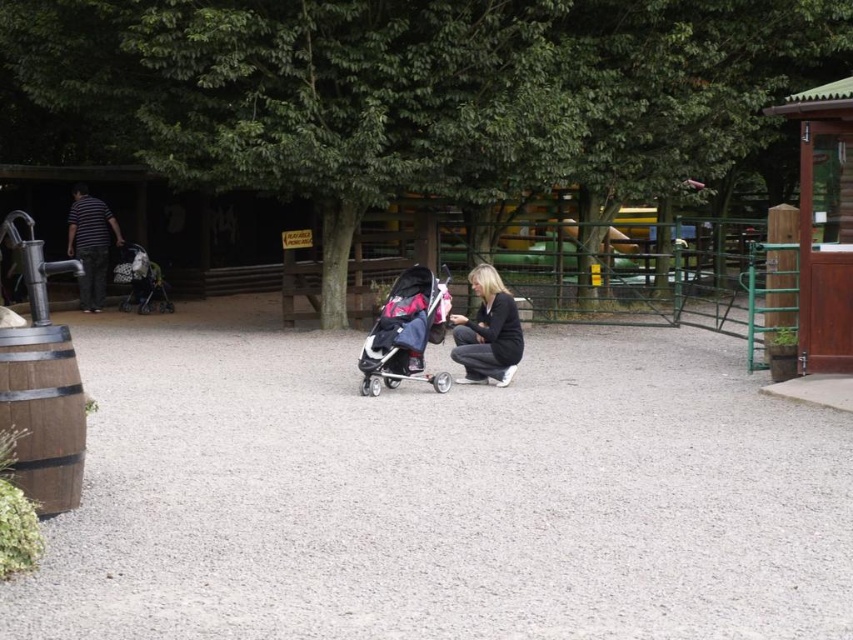
Question: Is gray gravel at center behind pink fabric stroller at center?

Choices:
 (A) no
 (B) yes

Answer: (A)

Question: Can you confirm if pink fabric stroller at center is thinner than dark gray fabric jacket at center?

Choices:
 (A) no
 (B) yes

Answer: (A)

Question: Can you confirm if pink fabric stroller at center is positioned to the left of dark gray fabric jacket at center?

Choices:
 (A) no
 (B) yes

Answer: (B)

Question: Estimate the real-world distances between objects in this image. Which object is closer to the gray gravel at center?

Choices:
 (A) pink fabric stroller at center
 (B) dark gray fabric jacket at center

Answer: (A)

Question: Which of the following is the closest to the observer?

Choices:
 (A) (503, 320)
 (B) (440, 332)

Answer: (B)

Question: Which of the following is the farthest from the observer?

Choices:
 (A) (695, 577)
 (B) (397, 358)
 (C) (466, 358)

Answer: (C)